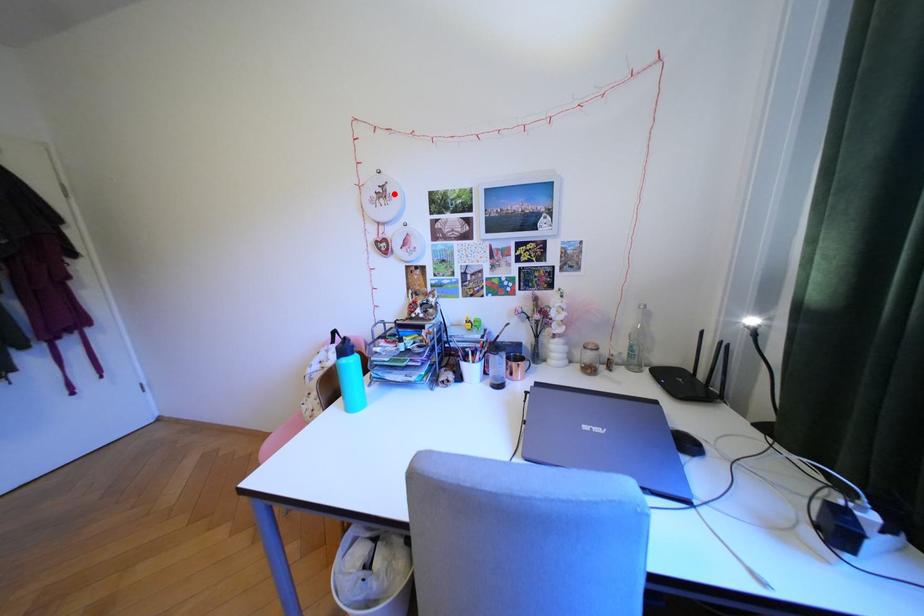
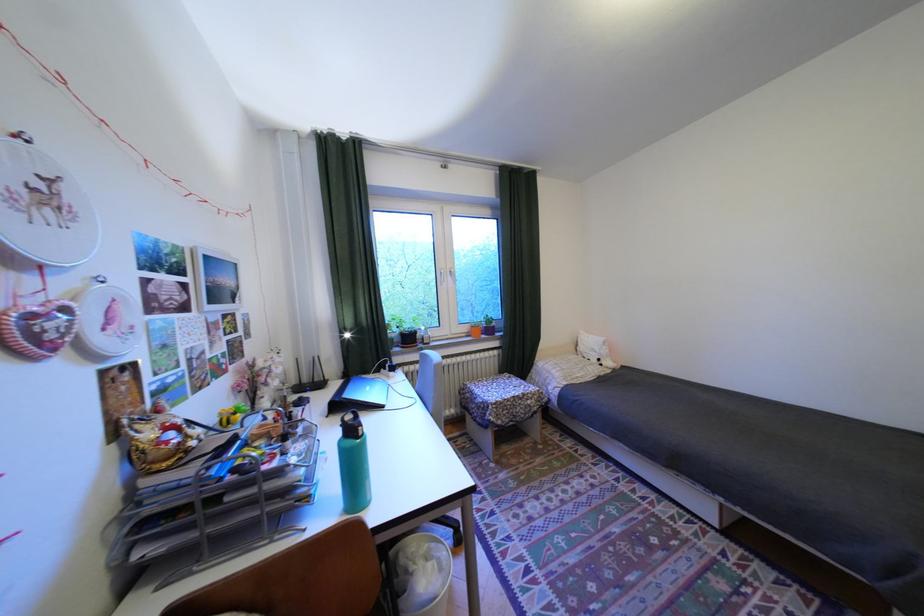
Locate, in the second image, the point that corresponds to the highlighted location in the first image.

(58, 197)